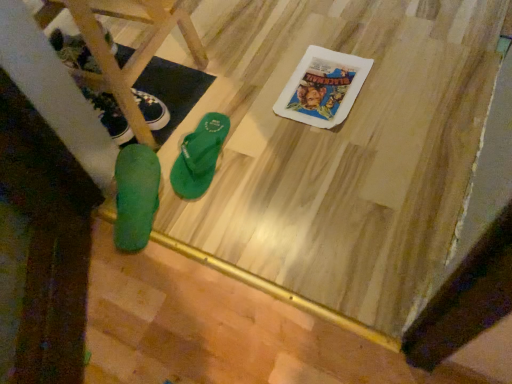
This screenshot has width=512, height=384. In order to click on vacant area that lies between green rubber flip-flop at lower left, which is the 2th footwear from left to right, and green rubber flip-flop at center, the third footwear positioned from the left in this screenshot , I will do `click(173, 172)`.